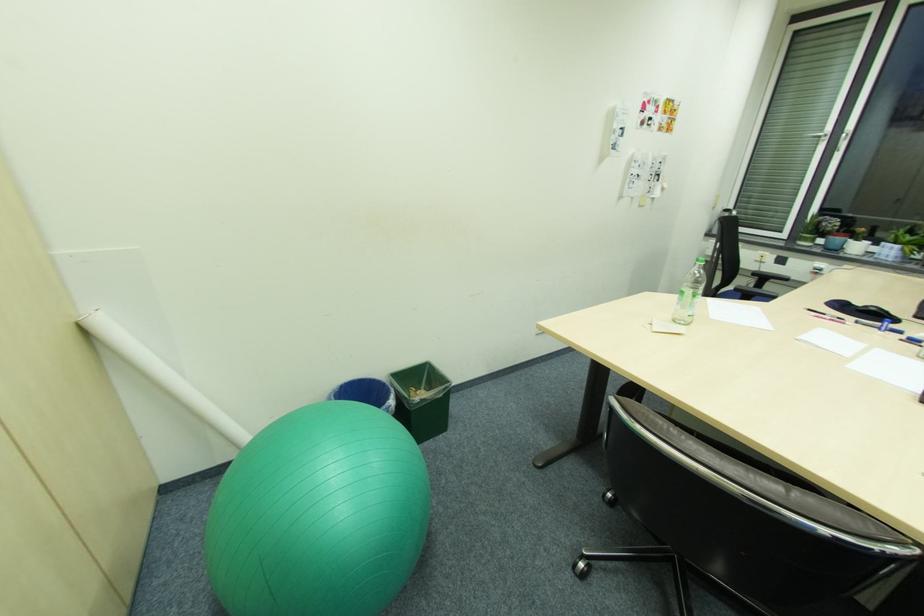
Describe the element at coordinates (817, 136) in the screenshot. Image resolution: width=924 pixels, height=616 pixels. I see `the white window handle` at that location.